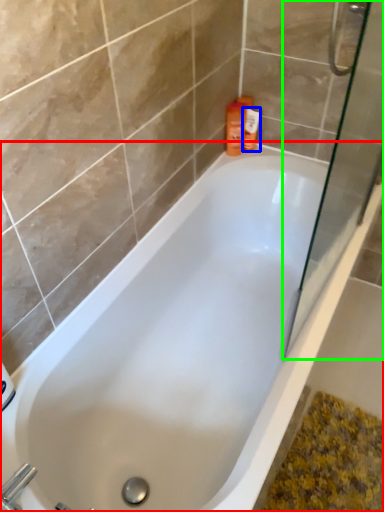
Question: Estimate the real-world distances between objects in this image. Which object is closer to bathtub (highlighted by a red box), toiletry (highlighted by a blue box) or screen door (highlighted by a green box)?

Choices:
 (A) toiletry
 (B) screen door

Answer: (B)